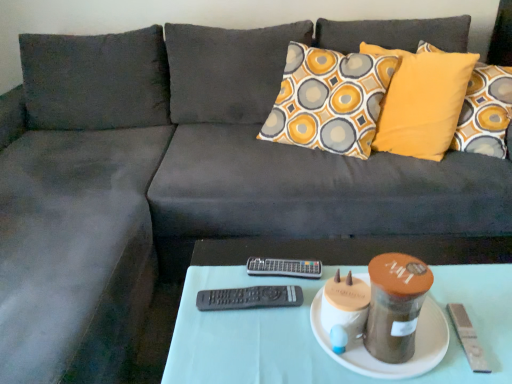
At what (x,y) coordinates should I click in order to perform the action: click on white ceramic plate at center. Please return your answer as a coordinate pair (x, y). This screenshot has height=384, width=512. Looking at the image, I should click on (387, 363).

The height and width of the screenshot is (384, 512). Describe the element at coordinates (249, 298) in the screenshot. I see `black plastic remote at center, the 1th remote when ordered from front to back` at that location.

At what (x,y) coordinates should I click in order to perform the action: click on white ceramic plate at center. Please return your answer as a coordinate pair (x, y). This screenshot has width=512, height=384. Looking at the image, I should click on (387, 363).

Which object is more forward, black plastic remote at center, the 1th remote when ordered from bottom to top, or black plastic remote at center, placed as the first remote when sorted from back to front?

black plastic remote at center, the 1th remote when ordered from bottom to top, is closer to the camera.

From the image's perspective, is black plastic remote at center, marked as the 2th remote in a top-to-bottom arrangement, located above or below black plastic remote at center, positioned as the first remote in top-to-bottom order?

Clearly, from the image's perspective, black plastic remote at center, marked as the 2th remote in a top-to-bottom arrangement, is below black plastic remote at center, positioned as the first remote in top-to-bottom order.

Between point (294, 294) and point (317, 277), which one is positioned in front?

Point (294, 294)

Identify the location of remote behind the black plastic remote at center, the second remote when ordered from back to front. This screenshot has width=512, height=384. (284, 267).

From a real-world perspective, who is located lower, black plastic remote at center, placed as the first remote when sorted from back to front, or black plastic remote at center, the 1th remote when ordered from bottom to top?

black plastic remote at center, placed as the first remote when sorted from back to front, is physically lower.

From the image's perspective, which one is positioned lower, black plastic remote at center, positioned as the first remote in top-to-bottom order, or black plastic remote at center, the 1th remote when ordered from bottom to top?

black plastic remote at center, the 1th remote when ordered from bottom to top.

Is black plastic remote at center, marked as the second remote in a bottom-to-top arrangement, facing towards black plastic remote at center, the second remote when ordered from back to front?

Yes, black plastic remote at center, marked as the second remote in a bottom-to-top arrangement, is oriented towards black plastic remote at center, the second remote when ordered from back to front.

Are white fabric table at center and white ceramic plate at center far apart?

No, there isn't a large distance between white fabric table at center and white ceramic plate at center.

Can you confirm if white fabric table at center is positioned to the right of white ceramic plate at center?

In fact, white fabric table at center is to the left of white ceramic plate at center.

From a real-world perspective, is white fabric table at center physically located above or below white ceramic plate at center?

white fabric table at center is below white ceramic plate at center.

Which object is further away from the camera, white ceramic plate at center or black plastic remote at center, positioned as the first remote in top-to-bottom order?

black plastic remote at center, positioned as the first remote in top-to-bottom order, is further from the camera.

From the image's perspective, is white ceramic plate at center over black plastic remote at center, marked as the second remote in a bottom-to-top arrangement?

Incorrect, from the image's perspective, white ceramic plate at center is lower than black plastic remote at center, marked as the second remote in a bottom-to-top arrangement.

Is white ceramic plate at center located outside black plastic remote at center, which is counted as the second remote, starting from the front?

Yes, white ceramic plate at center is not within black plastic remote at center, which is counted as the second remote, starting from the front.

Can you confirm if black plastic remote at center, the 1th remote when ordered from bottom to top, is taller than white fabric table at center?

Incorrect, the height of black plastic remote at center, the 1th remote when ordered from bottom to top, is not larger of that of white fabric table at center.

In the scene shown: Does black plastic remote at center, marked as the 2th remote in a top-to-bottom arrangement, come behind white fabric table at center?

Yes, black plastic remote at center, marked as the 2th remote in a top-to-bottom arrangement, is behind white fabric table at center.

Is black plastic remote at center, the 1th remote when ordered from front to back, looking in the opposite direction of white fabric table at center?

No, black plastic remote at center, the 1th remote when ordered from front to back, is not facing away from white fabric table at center.

Does point (254, 292) come closer to viewer compared to point (455, 374)?

No, it is not.

In the image, there is a white ceramic plate at center. At what (x,y) coordinates should I click in order to perform the action: click on table below it (from the image's perspective). Please return your answer as a coordinate pair (x, y). Looking at the image, I should click on (316, 338).

From a real-world perspective, is white ceramic plate at center positioned above or below white fabric table at center?

white ceramic plate at center is situated higher than white fabric table at center in the real world.

Considering the sizes of objects white ceramic plate at center and white fabric table at center in the image provided, who is smaller, white ceramic plate at center or white fabric table at center?

Smaller between the two is white ceramic plate at center.

Between white fabric table at center and black plastic remote at center, placed as the first remote when sorted from back to front, which one is positioned in front?

white fabric table at center is in front.

Would you consider white fabric table at center to be distant from black plastic remote at center, placed as the first remote when sorted from back to front?

No, white fabric table at center is in close proximity to black plastic remote at center, placed as the first remote when sorted from back to front.

From the image's perspective, does white fabric table at center appear lower than black plastic remote at center, positioned as the first remote in top-to-bottom order?

Indeed, from the image's perspective, white fabric table at center is shown beneath black plastic remote at center, positioned as the first remote in top-to-bottom order.

From the picture: Which is nearer, (316, 352) or (301, 266)?

The point (316, 352) is closer.

In order to click on remote below the black plastic remote at center, placed as the first remote when sorted from back to front (from the image's perspective) in this screenshot , I will do tap(249, 298).

Locate an element on the screen. remote that appears above the black plastic remote at center, marked as the second remote in a bottom-to-top arrangement (from a real-world perspective) is located at coordinates (249, 298).

From the image, which object appears to be nearer to white ceramic plate at center, black plastic remote at center, positioned as the first remote in top-to-bottom order, or white fabric table at center?

white fabric table at center lies closer to white ceramic plate at center than the other object.

Estimate the real-world distances between objects in this image. Which object is further from black plastic remote at center, placed as the first remote when sorted from back to front, black plastic remote at center, the 1th remote when ordered from bottom to top, or white ceramic plate at center?

The object further to black plastic remote at center, placed as the first remote when sorted from back to front, is white ceramic plate at center.

Based on their spatial positions, is white ceramic plate at center or white fabric table at center closer to black plastic remote at center, which is counted as the second remote, starting from the front?

white fabric table at center.

Which object lies further to the anchor point black plastic remote at center, positioned as the first remote in top-to-bottom order, white ceramic plate at center or black plastic remote at center, marked as the 2th remote in a top-to-bottom arrangement?

white ceramic plate at center.

From the image, which object appears to be farther from black plastic remote at center, the second remote when ordered from back to front, white fabric table at center or black plastic remote at center, placed as the first remote when sorted from back to front?

The object further to black plastic remote at center, the second remote when ordered from back to front, is white fabric table at center.

When comparing their distances from white ceramic plate at center, does black plastic remote at center, the 1th remote when ordered from bottom to top, or white fabric table at center seem closer?

white fabric table at center.

Considering their positions, is black plastic remote at center, marked as the second remote in a bottom-to-top arrangement, positioned closer to black plastic remote at center, the second remote when ordered from back to front, than white ceramic plate at center?

Based on the image, black plastic remote at center, marked as the second remote in a bottom-to-top arrangement, appears to be nearer to black plastic remote at center, the second remote when ordered from back to front.

Looking at the image, which one is located closer to white ceramic plate at center, black plastic remote at center, the second remote when ordered from back to front, or black plastic remote at center, placed as the first remote when sorted from back to front?

black plastic remote at center, the second remote when ordered from back to front, is positioned closer to the anchor white ceramic plate at center.

Where is `remote situated between black plastic remote at center, marked as the 2th remote in a top-to-bottom arrangement, and white ceramic plate at center from left to right`? The height and width of the screenshot is (384, 512). remote situated between black plastic remote at center, marked as the 2th remote in a top-to-bottom arrangement, and white ceramic plate at center from left to right is located at coordinates click(x=284, y=267).

Locate an element on the screen. This screenshot has height=384, width=512. plate between white fabric table at center and black plastic remote at center, placed as the first remote when sorted from back to front, in the front-back direction is located at coordinates (387, 363).

Find the location of a particular element. table between black plastic remote at center, the second remote when ordered from back to front, and white ceramic plate at center is located at coordinates (316, 338).

Find the location of a particular element. The image size is (512, 384). remote located between black plastic remote at center, the second remote when ordered from back to front, and white fabric table at center in the left-right direction is located at coordinates (284, 267).